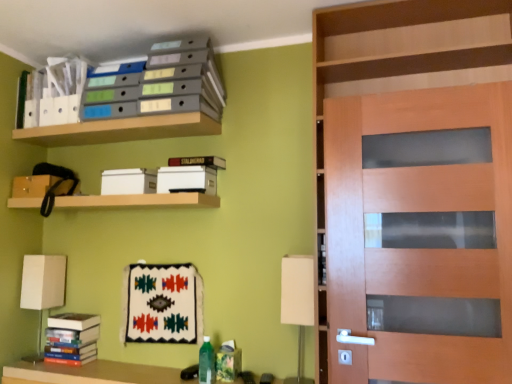
Question: Which direction should I rotate to face hardcover book at upper center, which is the 1th book in right-to-left order, — up or down?

Choices:
 (A) up
 (B) down

Answer: (A)

Question: From a real-world perspective, is white fabric lampshade at lower right, which appears as the 1th table lamp when viewed from the front, located higher than hardcover books at lower left, marked as the 1th book in a left-to-right arrangement?

Choices:
 (A) no
 (B) yes

Answer: (B)

Question: From the image's perspective, is white fabric lampshade at lower right, the 2th table lamp positioned from the back, on hardcover books at lower left, the 2th book when ordered from right to left?

Choices:
 (A) no
 (B) yes

Answer: (B)

Question: Does white fabric lampshade at lower right, placed as the 2th table lamp when sorted from left to right, have a greater height compared to hardcover books at lower left, the 2th book when ordered from right to left?

Choices:
 (A) no
 (B) yes

Answer: (B)

Question: Considering the relative sizes of white fabric lampshade at lower right, which is counted as the first table lamp, starting from the right, and hardcover books at lower left, marked as the 1th book in a left-to-right arrangement, in the image provided, is white fabric lampshade at lower right, which is counted as the first table lamp, starting from the right, wider than hardcover books at lower left, marked as the 1th book in a left-to-right arrangement,?

Choices:
 (A) no
 (B) yes

Answer: (A)

Question: Can you confirm if white fabric lampshade at lower right, which appears as the 1th table lamp when viewed from the front, is thinner than hardcover books at lower left, the 2th book when ordered from right to left?

Choices:
 (A) no
 (B) yes

Answer: (B)

Question: Is white fabric lampshade at lower right, placed as the 2th table lamp when sorted from left to right, directly adjacent to hardcover books at lower left, the 2th book when ordered from right to left?

Choices:
 (A) no
 (B) yes

Answer: (A)

Question: From the image's perspective, is wooden shelf at upper center, which is counted as the first shelf, starting from the bottom, under white fabric table lamp at lower left, placed as the second table lamp when sorted from front to back?

Choices:
 (A) yes
 (B) no

Answer: (B)

Question: From a real-world perspective, is wooden shelf at upper center, acting as the 3th shelf starting from the top, on top of white fabric table lamp at lower left, which appears as the first table lamp when viewed from the back?

Choices:
 (A) no
 (B) yes

Answer: (B)

Question: Would you say wooden shelf at upper center, acting as the 3th shelf starting from the top, contains white fabric table lamp at lower left, marked as the 1th table lamp in a left-to-right arrangement?

Choices:
 (A) no
 (B) yes

Answer: (A)

Question: Can you confirm if wooden shelf at upper center, acting as the 3th shelf starting from the top, is bigger than white fabric table lamp at lower left, which appears as the first table lamp when viewed from the back?

Choices:
 (A) yes
 (B) no

Answer: (A)

Question: Is wooden shelf at upper center, which is counted as the first shelf, starting from the bottom, looking in the opposite direction of white fabric table lamp at lower left, placed as the second table lamp when sorted from front to back?

Choices:
 (A) yes
 (B) no

Answer: (B)

Question: Is wooden shelf at upper center, which is counted as the first shelf, starting from the bottom, oriented towards white fabric table lamp at lower left, placed as the second table lamp when sorted from front to back?

Choices:
 (A) yes
 (B) no

Answer: (B)

Question: Is wooden door at right not close to white fabric table lamp at lower left, which appears as the first table lamp when viewed from the back?

Choices:
 (A) yes
 (B) no

Answer: (A)